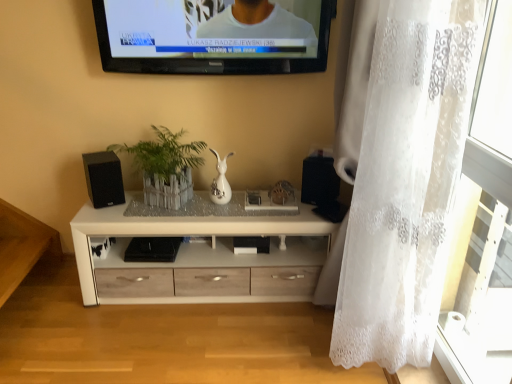
Question: Is black matte speaker at left, the first speaker positioned from the left, wider than white wood chest of drawers at center?

Choices:
 (A) yes
 (B) no

Answer: (B)

Question: From a real-world perspective, is black matte speaker at left, which is the 2th speaker in right-to-left order, physically below white wood chest of drawers at center?

Choices:
 (A) no
 (B) yes

Answer: (A)

Question: Is black matte speaker at left, which is the 2th speaker in right-to-left order, aimed at white wood chest of drawers at center?

Choices:
 (A) no
 (B) yes

Answer: (A)

Question: Does black matte speaker at left, the first speaker positioned from the left, have a lesser height compared to white wood chest of drawers at center?

Choices:
 (A) yes
 (B) no

Answer: (A)

Question: Does black matte speaker at left, which is the 2th speaker in right-to-left order, come in front of white wood chest of drawers at center?

Choices:
 (A) no
 (B) yes

Answer: (A)

Question: In the image, is black glossy television at upper center positioned in front of or behind black matte speaker at right, placed as the second speaker when sorted from left to right?

Choices:
 (A) behind
 (B) front

Answer: (B)

Question: In terms of size, does black glossy television at upper center appear bigger or smaller than black matte speaker at right, placed as the second speaker when sorted from left to right?

Choices:
 (A) big
 (B) small

Answer: (A)

Question: Would you say black glossy television at upper center is to the left or to the right of black matte speaker at right, acting as the 1th speaker starting from the right, in the picture?

Choices:
 (A) right
 (B) left

Answer: (B)

Question: Considering the positions of point (225, 51) and point (306, 165), is point (225, 51) closer or farther from the camera than point (306, 165)?

Choices:
 (A) farther
 (B) closer

Answer: (B)

Question: Is green leafy plant at center bigger or smaller than white wood chest of drawers at center?

Choices:
 (A) big
 (B) small

Answer: (B)

Question: Is green leafy plant at center taller or shorter than white wood chest of drawers at center?

Choices:
 (A) tall
 (B) short

Answer: (B)

Question: Looking at their shapes, would you say green leafy plant at center is wider or thinner than white wood chest of drawers at center?

Choices:
 (A) thin
 (B) wide

Answer: (A)

Question: In the image, is green leafy plant at center on the left side or the right side of white wood chest of drawers at center?

Choices:
 (A) left
 (B) right

Answer: (A)

Question: Looking at the image, does white wood chest of drawers at center seem bigger or smaller compared to white lace curtain at right?

Choices:
 (A) big
 (B) small

Answer: (B)

Question: Considering their positions, is white wood chest of drawers at center located in front of or behind white lace curtain at right?

Choices:
 (A) front
 (B) behind

Answer: (B)